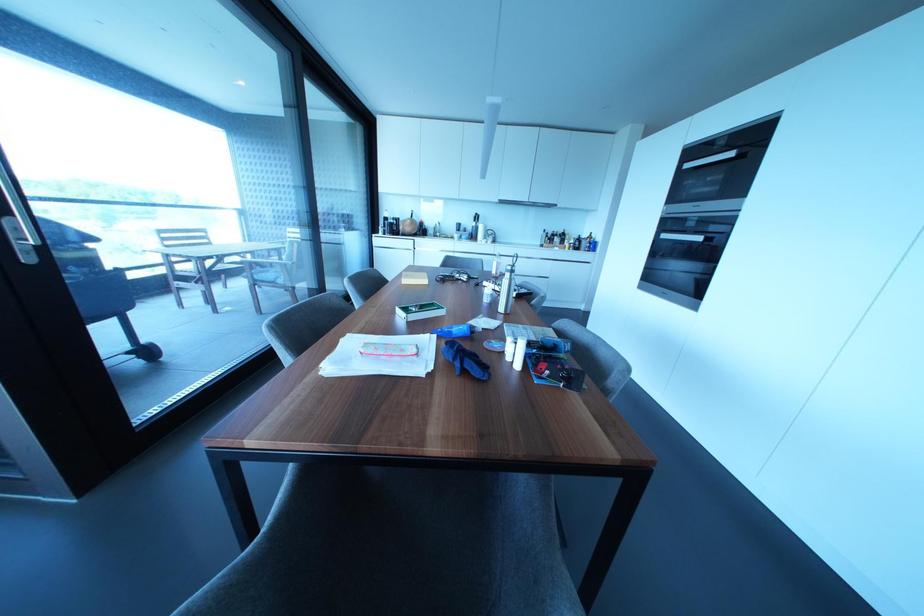
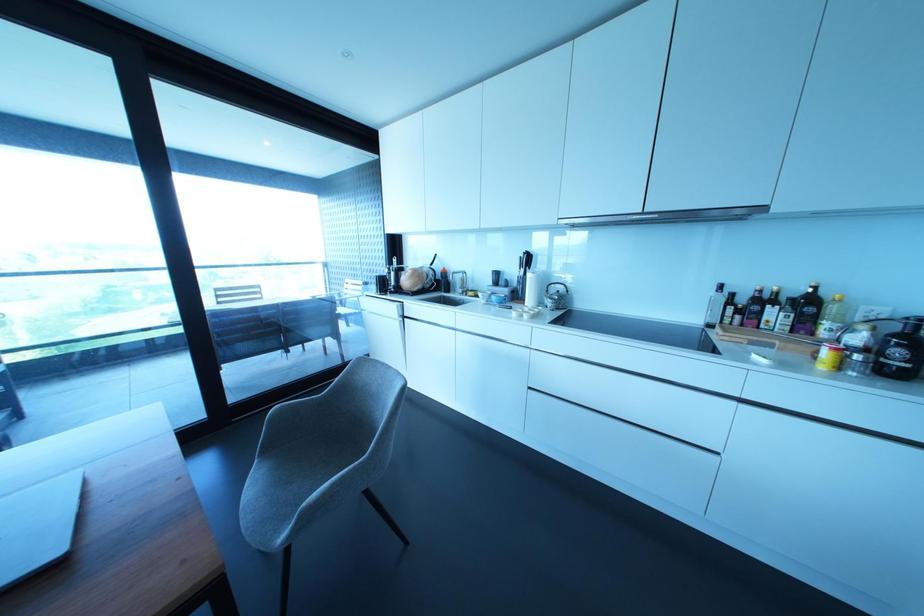
Find the pixel in the second image that matches point (562, 235) in the first image.

(807, 304)